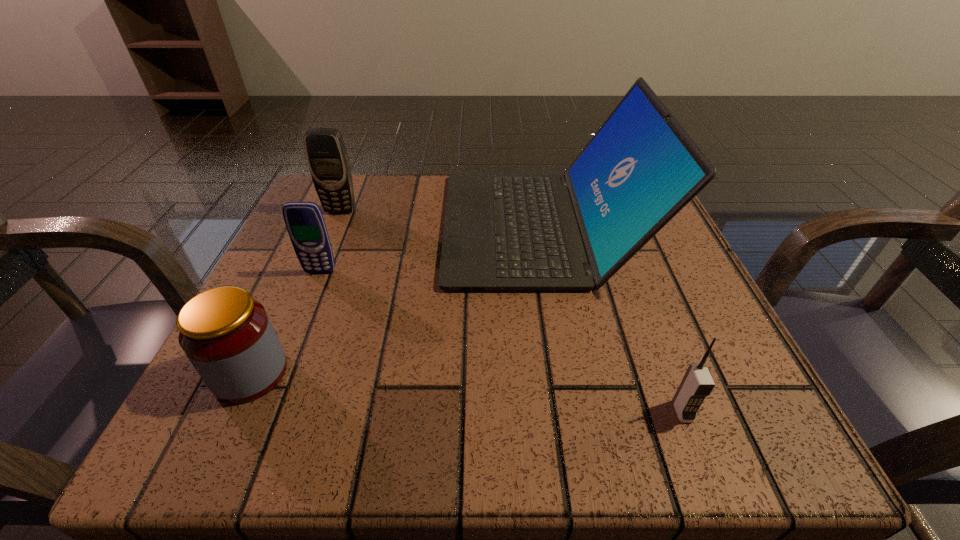
Locate an element on the screen. vacant space that is in between the jar and the laptop computer is located at coordinates click(x=396, y=299).

At what (x,y) coordinates should I click in order to perform the action: click on free space between the second tallest object and the rightmost cellular telephone. Please return your answer as a coordinate pair (x, y). Looking at the image, I should click on (512, 311).

You are a GUI agent. You are given a task and a screenshot of the screen. Output one action in this format:
    pyautogui.click(x=<x>, y=<y>)
    Task: Click on the empty location between the nearest cellular telephone and the jar
    This screenshot has width=960, height=540.
    Given the screenshot: What is the action you would take?
    pyautogui.click(x=467, y=393)

You are a GUI agent. You are given a task and a screenshot of the screen. Output one action in this format:
    pyautogui.click(x=<x>, y=<y>)
    Task: Click on the vacant space that's between the second nearest cellular telephone and the tallest object
    
    Given the screenshot: What is the action you would take?
    pyautogui.click(x=432, y=249)

This screenshot has width=960, height=540. Find the location of `empty space that is in between the nearest cellular telephone and the laptop computer`. empty space that is in between the nearest cellular telephone and the laptop computer is located at coordinates (612, 319).

The width and height of the screenshot is (960, 540). Identify the location of vacant space that's between the nearest cellular telephone and the jar. (467, 393).

Locate an element on the screen. The height and width of the screenshot is (540, 960). vacant space that's between the tallest object and the second nearest cellular telephone is located at coordinates (432, 249).

You are a GUI agent. You are given a task and a screenshot of the screen. Output one action in this format:
    pyautogui.click(x=<x>, y=<y>)
    Task: Click on the blank region between the rightmost cellular telephone and the second farthest cellular telephone
    
    Given the screenshot: What is the action you would take?
    pyautogui.click(x=501, y=342)

Image resolution: width=960 pixels, height=540 pixels. I want to click on the fourth closest object to the second farthest cellular telephone, so click(x=697, y=383).

Identify which object is located as the third nearest to the jar. Please provide its 2D coordinates. Your answer should be formatted as a tuple, i.e. [(x, y)], where the tuple contains the x and y coordinates of a point satisfying the conditions above.

[(328, 161)]